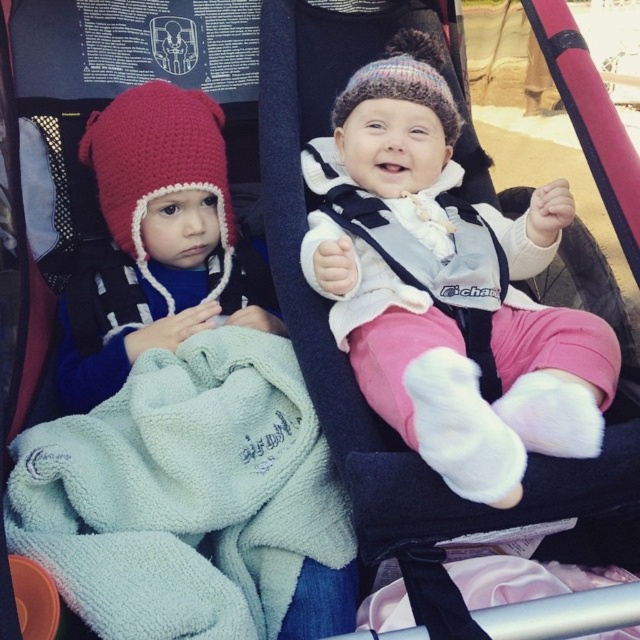
You are a photographer taking a closeup shot of the two hats on the children in the stroller. The matte red knit hat at left and the crochet knit hat at left are both in your frame. Given that your camera has a focus range of 1 inch, will both hats be in focus?

The matte red knit hat at left is 1.12 inches from crochet knit hat at left. Since the distance between them exceeds the camera focus range of 1 inch, only one of the hats will be in focus at a time.

You are a parent trying to choose a hat for your child based on the image. The knitted woolen hat at center and the crochet knit hat at left are both options. Which hat would provide more vertical coverage for the ears and neck?

The knitted woolen hat at center is taller than the crochet knit hat at left, so it would provide more vertical coverage for the ears and neck.